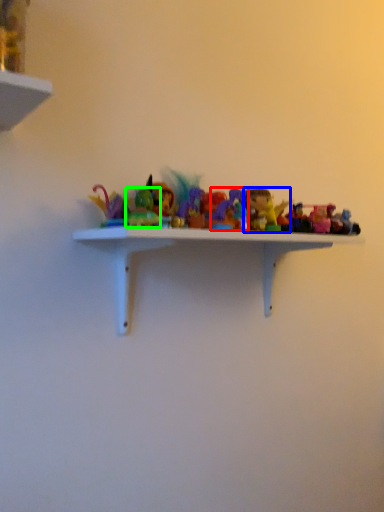
Question: Based on their relative distances, which object is farther from toy (highlighted by a red box)? Choose from toy (highlighted by a blue box) and toy (highlighted by a green box).

Choices:
 (A) toy
 (B) toy

Answer: (B)